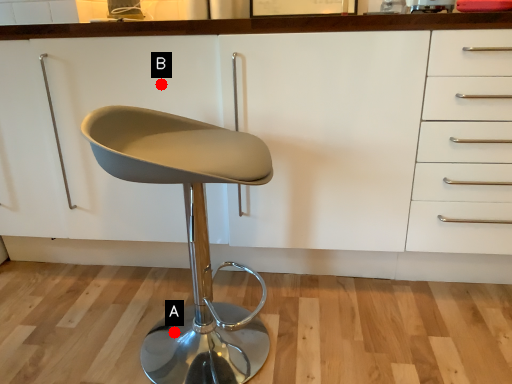
Question: Two points are circled on the image, labeled by A and B beside each circle. Among these points, which one is nearest to the camera?

Choices:
 (A) A is closer
 (B) B is closer

Answer: (B)